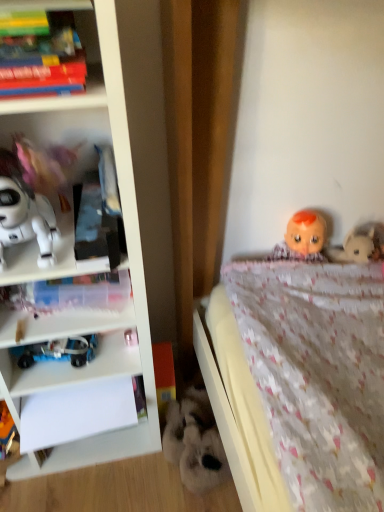
Locate an element on the screen. white plastic bookcase at left is located at coordinates (125, 234).

This screenshot has width=384, height=512. What do you see at coordinates (45, 167) in the screenshot? I see `pink fabric doll at left, which ranks as the 1th toy in top-to-bottom order` at bounding box center [45, 167].

In order to face blue plastic toy at lower left, the 3th toy when ordered from top to bottom, should I rotate leftwards or rightwards?

To align with it, rotate left about 17.696°.

Looking at this image, measure the distance between point (30, 303) and camera.

Point (30, 303) and camera are 3.37 feet apart.

How much space does fluffy white stuffed animal at lower center, placed as the 4th toy when sorted from top to bottom, occupy horizontally?

The width of fluffy white stuffed animal at lower center, placed as the 4th toy when sorted from top to bottom, is 21.42 centimeters.

Locate an element on the screen. white plastic bookcase at left is located at coordinates (125, 234).

Choose the correct answer: Is matte plastic books at upper left inside white plastic bookcase at left or outside it?

matte plastic books at upper left fits inside white plastic bookcase at left.

Looking at this image, relative to white plastic bookcase at left, is matte plastic books at upper left in front or behind?

In the image, matte plastic books at upper left appears behind white plastic bookcase at left.

Which is in front, point (101, 88) or point (153, 163)?

The point (101, 88) is closer.

Considering the sizes of matte plastic books at upper left and white plastic bookcase at left in the image, is matte plastic books at upper left taller or shorter than white plastic bookcase at left?

In the image, matte plastic books at upper left appears to be shorter than white plastic bookcase at left.

Is pink fabric doll at left, which is the 3th toy from left to right, wider than white plastic bookcase at left?

No.

Locate an element on the screen. Image resolution: width=384 pixels, height=512 pixels. the 2nd toy behind the white plastic bookcase at left is located at coordinates click(x=45, y=167).

From the image's perspective, which one is positioned higher, pink fabric doll at left, which is the 3th toy from left to right, or white plastic bookcase at left?

pink fabric doll at left, which is the 3th toy from left to right, is shown above in the image.

Is pink fabric doll at left, the second toy when ordered from right to left, surrounding white plastic bookcase at left?

Definitely not — white plastic bookcase at left is not inside pink fabric doll at left, the second toy when ordered from right to left.

Can you tell me how much white matte robot at left, arranged as the 4th toy when viewed from the right, and transparent plastic book at left differ in facing direction?

white matte robot at left, arranged as the 4th toy when viewed from the right, and transparent plastic book at left are facing 2.07 degrees away from each other.

Is white matte robot at left, arranged as the 1th toy when viewed from the left, not close to transparent plastic book at left?

No, white matte robot at left, arranged as the 1th toy when viewed from the left, is in close proximity to transparent plastic book at left.

Which point is more distant from viewer, (45,204) or (10,305)?

The point (10,305) is behind.

Does white matte robot at left, arranged as the 1th toy when viewed from the left, appear on the right side of transparent plastic book at left?

Incorrect, white matte robot at left, arranged as the 1th toy when viewed from the left, is not on the right side of transparent plastic book at left.

Is pink fabric doll at left, arranged as the fourth toy when ordered from the bottom, next to fluffy white stuffed animal at lower center, placed as the 4th toy when sorted from top to bottom?

pink fabric doll at left, arranged as the fourth toy when ordered from the bottom, and fluffy white stuffed animal at lower center, placed as the 4th toy when sorted from top to bottom, are clearly separated.

Is pink fabric doll at left, the second toy when ordered from right to left, completely or partially outside of fluffy white stuffed animal at lower center, acting as the 1th toy starting from the right?

pink fabric doll at left, the second toy when ordered from right to left, lies outside fluffy white stuffed animal at lower center, acting as the 1th toy starting from the right,'s area.

Which point is more distant from viewer, (23, 151) or (195, 469)?

Positioned behind is point (195, 469).

Starting from the pink fabric doll at left, the second toy when ordered from right to left, which toy is the 2nd one behind? Please provide its 2D coordinates.

[(195, 442)]

Is point (63, 344) positioned before point (67, 288)?

That is False.

Considering the sizes of blue plastic toy at lower left, marked as the 2th toy in a left-to-right arrangement, and transparent plastic book at left in the image, is blue plastic toy at lower left, marked as the 2th toy in a left-to-right arrangement, taller or shorter than transparent plastic book at left?

blue plastic toy at lower left, marked as the 2th toy in a left-to-right arrangement, is shorter than transparent plastic book at left.

From the image's perspective, does blue plastic toy at lower left, which is the 2th toy from bottom to top, appear higher than transparent plastic book at left?

No, from the image's perspective, blue plastic toy at lower left, which is the 2th toy from bottom to top, is not on top of transparent plastic book at left.

Is blue plastic toy at lower left, arranged as the third toy when viewed from the right, to the right of transparent plastic book at left from the viewer's perspective?

No.

Is white plastic bookcase at left directly adjacent to blue plastic toy at lower left, which is the 2th toy from bottom to top?

white plastic bookcase at left and blue plastic toy at lower left, which is the 2th toy from bottom to top, are clearly separated.

Is the position of white plastic bookcase at left more distant than that of blue plastic toy at lower left, which is the 2th toy from bottom to top?

No, it is not.

In terms of width, does white plastic bookcase at left look wider or thinner when compared to blue plastic toy at lower left, the 3th toy when ordered from top to bottom?

In the image, white plastic bookcase at left appears to be wider than blue plastic toy at lower left, the 3th toy when ordered from top to bottom.

Is point (80, 448) closer to viewer compared to point (42, 344)?

No, it is behind (42, 344).

How much distance is there between white plastic bookcase at left and pink fabric doll at left, which ranks as the 1th toy in top-to-bottom order?

The distance of white plastic bookcase at left from pink fabric doll at left, which ranks as the 1th toy in top-to-bottom order, is 10.03 inches.

From the image's perspective, which one is positioned lower, white plastic bookcase at left or pink fabric doll at left, which ranks as the 1th toy in top-to-bottom order?

From the image's view, white plastic bookcase at left is below.

Between point (5, 282) and point (45, 173), which one is positioned in front?

The point (5, 282) is closer.

Does white plastic bookcase at left have a smaller size compared to pink fabric doll at left, which ranks as the 1th toy in top-to-bottom order?

Actually, white plastic bookcase at left might be larger than pink fabric doll at left, which ranks as the 1th toy in top-to-bottom order.

Find the location of a particular element. bookcase below the matte plastic books at upper left (from the image's perspective) is located at coordinates (125, 234).

I want to click on the 2nd toy located above the white plastic bookcase at left (from a real-world perspective), so click(x=45, y=167).

Looking at the image, which one is located further to pink fabric doll at left, which ranks as the 1th toy in top-to-bottom order, blue plastic toy at lower left, the 3th toy when ordered from top to bottom, or transparent plastic book at left?

Among the two, blue plastic toy at lower left, the 3th toy when ordered from top to bottom, is located further to pink fabric doll at left, which ranks as the 1th toy in top-to-bottom order.

Which object lies further to the anchor point fluffy white stuffed animal at lower center, the fourth toy from the left, matte plastic books at upper left or white plastic bookcase at left?

matte plastic books at upper left is further to fluffy white stuffed animal at lower center, the fourth toy from the left.

From the image, which object appears to be nearer to pink fabric doll at left, which ranks as the 1th toy in top-to-bottom order, blue plastic toy at lower left, the 3th toy when ordered from top to bottom, or white plastic bookcase at left?

white plastic bookcase at left is closer to pink fabric doll at left, which ranks as the 1th toy in top-to-bottom order.

Looking at this image, based on their spatial positions, is white matte robot at left, the third toy in the bottom-to-top sequence, or matte plastic books at upper left closer to pink fabric doll at left, which is the 3th toy from left to right?

white matte robot at left, the third toy in the bottom-to-top sequence, lies closer to pink fabric doll at left, which is the 3th toy from left to right, than the other object.

Looking at this image, when comparing their distances from white plastic bookcase at left, does fluffy white stuffed animal at lower center, which is counted as the first toy, starting from the bottom, or pink fabric doll at left, arranged as the fourth toy when ordered from the bottom, seem closer?

pink fabric doll at left, arranged as the fourth toy when ordered from the bottom, is closer to white plastic bookcase at left.

When comparing their distances from white plastic bookcase at left, does matte plastic books at upper left or fluffy white stuffed animal at lower center, which is counted as the first toy, starting from the bottom, seem further?

matte plastic books at upper left is further to white plastic bookcase at left.

Considering their positions, is blue plastic toy at lower left, the 3th toy when ordered from top to bottom, positioned further to pink fabric doll at left, arranged as the fourth toy when ordered from the bottom, than white matte robot at left, the 2th toy in the top-to-bottom sequence?

blue plastic toy at lower left, the 3th toy when ordered from top to bottom.

Looking at the image, which one is located closer to white matte robot at left, the 2th toy in the top-to-bottom sequence, pink fabric doll at left, which is the 3th toy from left to right, or blue plastic toy at lower left, which is the 2th toy from bottom to top?

pink fabric doll at left, which is the 3th toy from left to right, is positioned closer to the anchor white matte robot at left, the 2th toy in the top-to-bottom sequence.

Locate an element on the screen. Image resolution: width=384 pixels, height=512 pixels. bookcase between matte plastic books at upper left and transparent plastic book at left vertically is located at coordinates (125, 234).

This screenshot has height=512, width=384. I want to click on toy between pink fabric doll at left, which ranks as the 1th toy in top-to-bottom order, and transparent plastic book at left, in the vertical direction, so click(x=24, y=213).

At what (x,y) coordinates should I click in order to perform the action: click on toy between matte plastic books at upper left and white matte robot at left, the third toy in the bottom-to-top sequence, in the up-down direction. Please return your answer as a coordinate pair (x, y). The width and height of the screenshot is (384, 512). Looking at the image, I should click on (45, 167).

The width and height of the screenshot is (384, 512). Find the location of `toy that lies between pink fabric doll at left, which ranks as the 1th toy in top-to-bottom order, and blue plastic toy at lower left, marked as the 2th toy in a left-to-right arrangement, from top to bottom`. toy that lies between pink fabric doll at left, which ranks as the 1th toy in top-to-bottom order, and blue plastic toy at lower left, marked as the 2th toy in a left-to-right arrangement, from top to bottom is located at coordinates (24, 213).